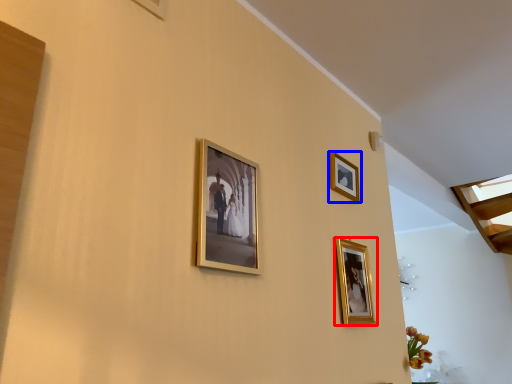
Question: Which object appears farthest to the camera in this image, picture frame (highlighted by a red box) or picture frame (highlighted by a blue box)?

Choices:
 (A) picture frame
 (B) picture frame

Answer: (B)